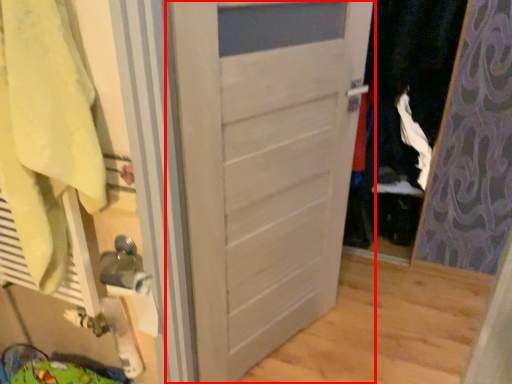
Question: From the image's perspective, where is door (annotated by the red box) located relative to bath towel?

Choices:
 (A) below
 (B) above

Answer: (A)